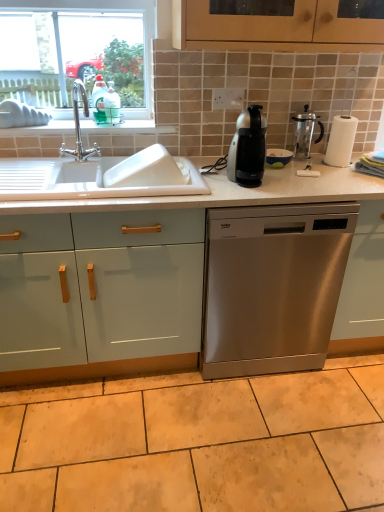
Question: Can you confirm if mint glossy cabinet doors at lower left is bigger than polished chrome faucet at upper left?

Choices:
 (A) no
 (B) yes

Answer: (B)

Question: Is mint glossy cabinet doors at lower left positioned far away from polished chrome faucet at upper left?

Choices:
 (A) no
 (B) yes

Answer: (A)

Question: Does mint glossy cabinet doors at lower left appear on the left side of polished chrome faucet at upper left?

Choices:
 (A) no
 (B) yes

Answer: (B)

Question: Is mint glossy cabinet doors at lower left behind polished chrome faucet at upper left?

Choices:
 (A) no
 (B) yes

Answer: (A)

Question: Is mint glossy cabinet doors at lower left shorter than polished chrome faucet at upper left?

Choices:
 (A) yes
 (B) no

Answer: (B)

Question: Is mint glossy cabinet doors at lower left next to polished chrome faucet at upper left?

Choices:
 (A) yes
 (B) no

Answer: (B)

Question: From a real-world perspective, is polished chrome faucet at upper left positioned over mint glossy cabinet doors at lower left based on gravity?

Choices:
 (A) no
 (B) yes

Answer: (B)

Question: Does polished chrome faucet at upper left have a larger size compared to mint glossy cabinet doors at lower left?

Choices:
 (A) no
 (B) yes

Answer: (A)

Question: Can you see polished chrome faucet at upper left touching mint glossy cabinet doors at lower left?

Choices:
 (A) no
 (B) yes

Answer: (A)

Question: Can you confirm if polished chrome faucet at upper left is taller than mint glossy cabinet doors at lower left?

Choices:
 (A) yes
 (B) no

Answer: (B)

Question: Is polished chrome faucet at upper left completely or partially outside of mint glossy cabinet doors at lower left?

Choices:
 (A) yes
 (B) no

Answer: (A)

Question: Is the position of polished chrome faucet at upper left more distant than that of mint glossy cabinet doors at lower left?

Choices:
 (A) no
 (B) yes

Answer: (B)

Question: Does clear glass window at upper left appear on the right side of beige ceramic tile at lower center?

Choices:
 (A) no
 (B) yes

Answer: (A)